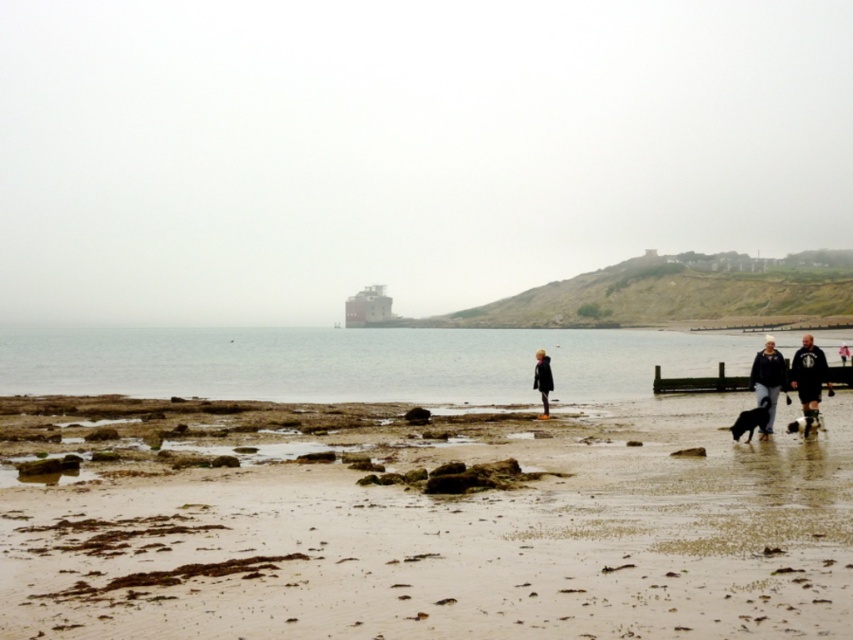
Does matte red building at center appear under metallic gray boat at center?

No.

Is the position of matte red building at center less distant than that of metallic gray boat at center?

No, matte red building at center is behind metallic gray boat at center.

Between point (199, 275) and point (374, 292), which one is positioned behind?

The point (199, 275) is more distant.

Find the location of a particular element. matte red building at center is located at coordinates (402, 148).

Can you confirm if sandy beach at lower center is taller than dark matte coat at center?

Incorrect, sandy beach at lower center's height is not larger of dark matte coat at center's.

You are a GUI agent. You are given a task and a screenshot of the screen. Output one action in this format:
    pyautogui.click(x=<x>, y=<y>)
    Task: Click on the sandy beach at lower center
    This screenshot has height=640, width=853.
    Given the screenshot: What is the action you would take?
    pyautogui.click(x=422, y=524)

Is dark blue jacket at lower right positioned in front of metallic gray boat at center?

Yes, it is in front of metallic gray boat at center.

Is dark blue jacket at lower right shorter than metallic gray boat at center?

Yes, dark blue jacket at lower right is shorter than metallic gray boat at center.

Between point (763, 381) and point (363, 294), which one is positioned in front?

Positioned in front is point (763, 381).

Where is `dark blue jacket at lower right`? The width and height of the screenshot is (853, 640). dark blue jacket at lower right is located at coordinates (769, 380).